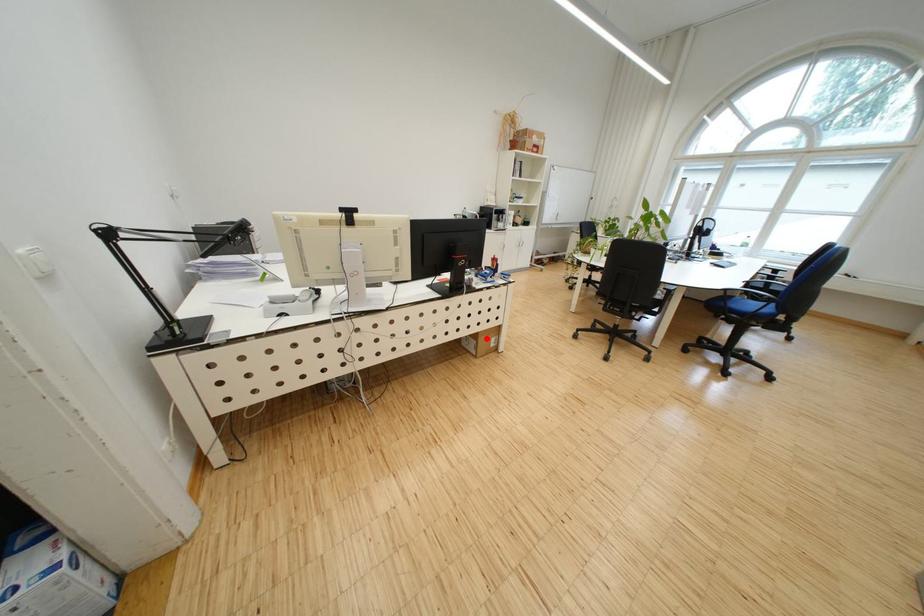
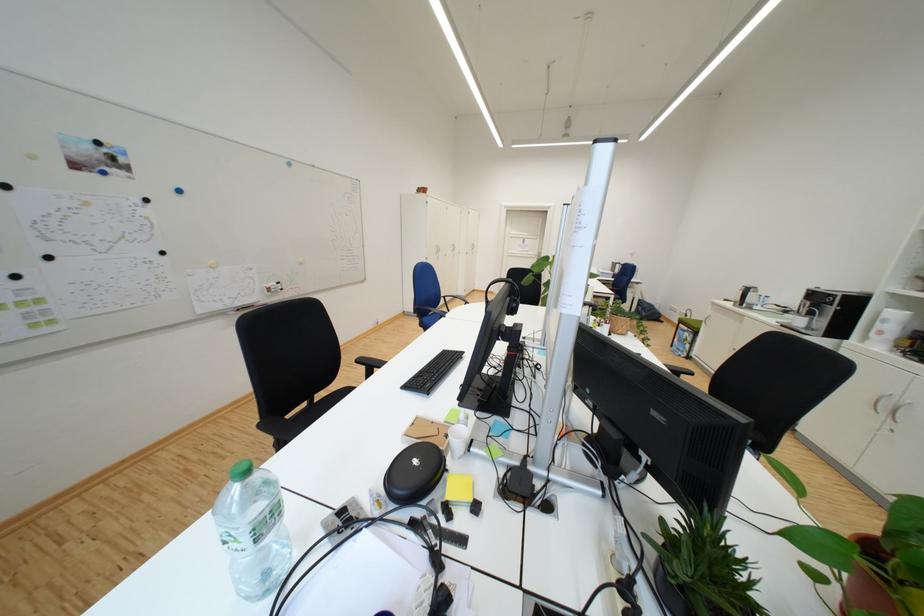
Question: I am providing you with two images of the same scene from different viewpoints. A red point is marked on the first image. Can you still see the location of the red point in image 2?

Choices:
 (A) Yes
 (B) No

Answer: (B)